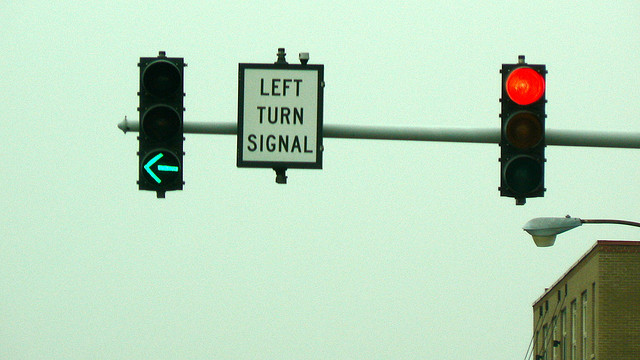
Find the location of a particular element. The height and width of the screenshot is (360, 640). unlit yellow light is located at coordinates pos(164,125), pos(521,131).